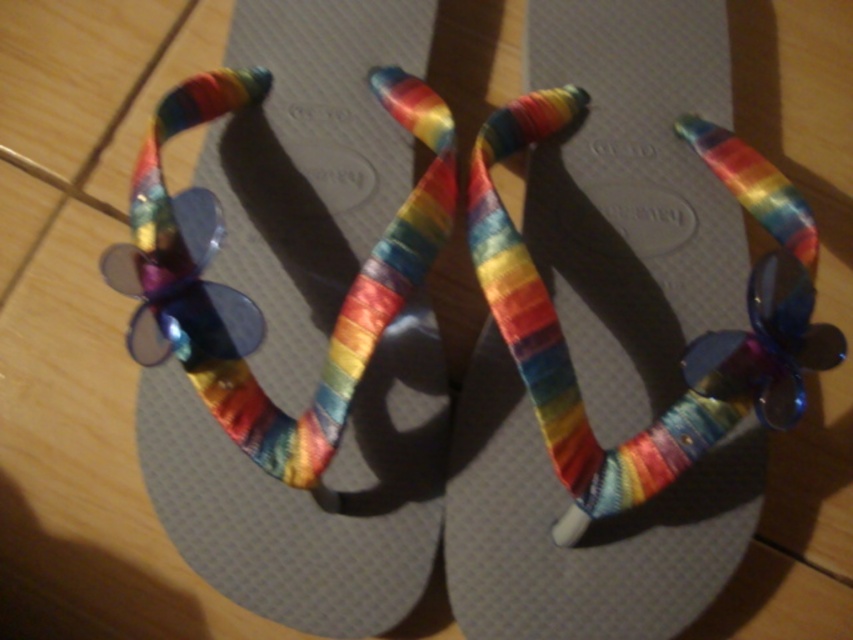
Question: Which object appears farthest from the camera in this image?

Choices:
 (A) rainbow fabric sandal at center
 (B) rainbow fabric ribbon at center
 (C) rainbow fabric flip-flop at center

Answer: (C)

Question: Can you confirm if rainbow fabric ribbon at center is positioned to the right of rainbow fabric flip-flop at center?

Choices:
 (A) yes
 (B) no

Answer: (B)

Question: Among these objects, which one is farthest from the camera?

Choices:
 (A) rainbow fabric sandal at center
 (B) rainbow fabric flip-flop at center
 (C) rainbow fabric ribbon at center

Answer: (B)

Question: Is rainbow fabric sandal at center to the left of rainbow fabric flip-flop at center from the viewer's perspective?

Choices:
 (A) no
 (B) yes

Answer: (B)

Question: Which point is closer to the camera?

Choices:
 (A) (808, 225)
 (B) (753, 451)
 (C) (245, 1)

Answer: (A)

Question: Can you confirm if rainbow fabric sandal at center is positioned above rainbow fabric ribbon at center?

Choices:
 (A) no
 (B) yes

Answer: (A)